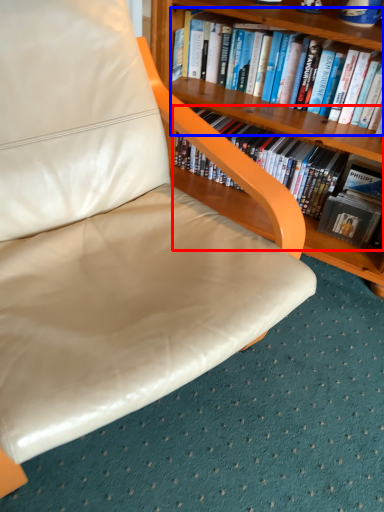
Question: Which object appears closest to the camera in this image, book (highlighted by a red box) or book (highlighted by a blue box)?

Choices:
 (A) book
 (B) book

Answer: (B)